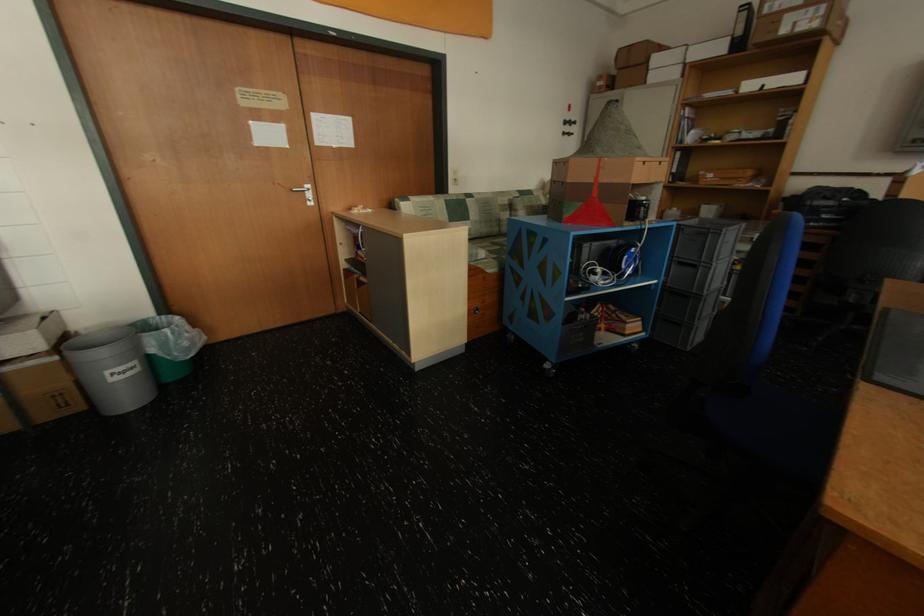
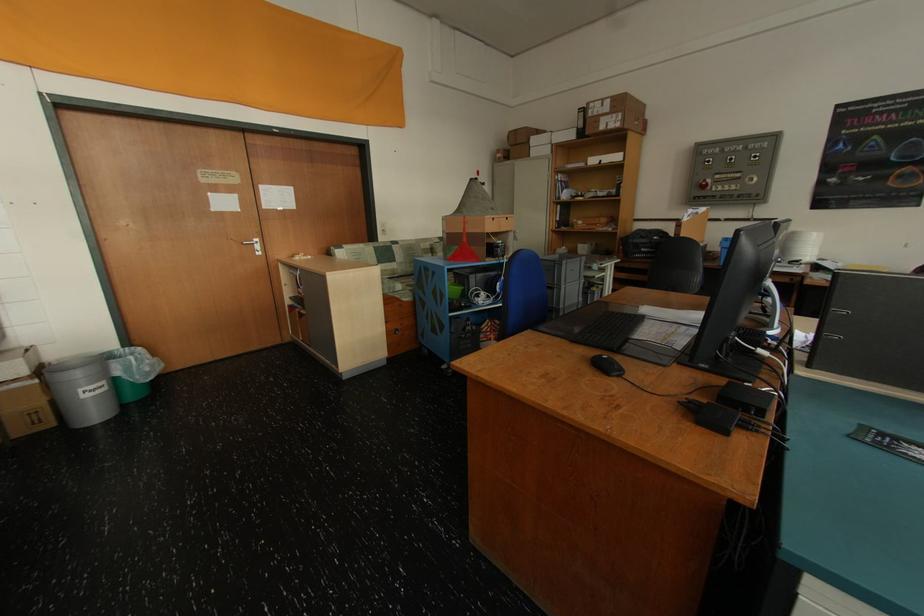
Where in the second image is the point corresponding to (589,206) from the first image?

(465, 249)